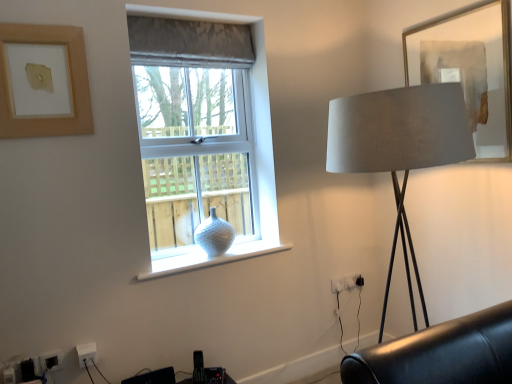
Question: Does gray textured fabric curtain at upper center contain white glossy vase at center?

Choices:
 (A) yes
 (B) no

Answer: (B)

Question: Does gray textured fabric curtain at upper center appear on the left side of white glossy vase at center?

Choices:
 (A) yes
 (B) no

Answer: (A)

Question: Is gray textured fabric curtain at upper center facing away from white glossy vase at center?

Choices:
 (A) yes
 (B) no

Answer: (B)

Question: Considering the relative sizes of gray textured fabric curtain at upper center and white glossy vase at center in the image provided, is gray textured fabric curtain at upper center wider than white glossy vase at center?

Choices:
 (A) yes
 (B) no

Answer: (B)

Question: Is gray textured fabric curtain at upper center not close to white glossy vase at center?

Choices:
 (A) no
 (B) yes

Answer: (B)

Question: Does gray textured fabric curtain at upper center have a greater height compared to white glossy vase at center?

Choices:
 (A) no
 (B) yes

Answer: (B)

Question: Is white plastic electric outlet at lower left, positioned as the first electric outlet in front-to-back order, oriented towards white textured vase at center?

Choices:
 (A) yes
 (B) no

Answer: (B)

Question: Is white plastic electric outlet at lower left, positioned as the first electric outlet in front-to-back order, located outside white textured vase at center?

Choices:
 (A) yes
 (B) no

Answer: (A)

Question: Is white plastic electric outlet at lower left, the 1th electric outlet in the bottom-to-top sequence, next to white textured vase at center and touching it?

Choices:
 (A) no
 (B) yes

Answer: (A)

Question: Does white plastic electric outlet at lower left, the third electric outlet viewed from the back, have a larger size compared to white textured vase at center?

Choices:
 (A) yes
 (B) no

Answer: (B)

Question: From the image's perspective, is white plastic electric outlet at lower left, positioned as the first electric outlet in front-to-back order, beneath white textured vase at center?

Choices:
 (A) no
 (B) yes

Answer: (B)

Question: Does white plastic electric outlet at lower left, arranged as the 3th electric outlet when viewed from the right, appear on the left side of white textured vase at center?

Choices:
 (A) no
 (B) yes

Answer: (B)

Question: Can you confirm if white plastic electric outlet at lower right, positioned as the first electric outlet in top-to-bottom order, is positioned to the right of satin beige lampshade at right?

Choices:
 (A) yes
 (B) no

Answer: (B)